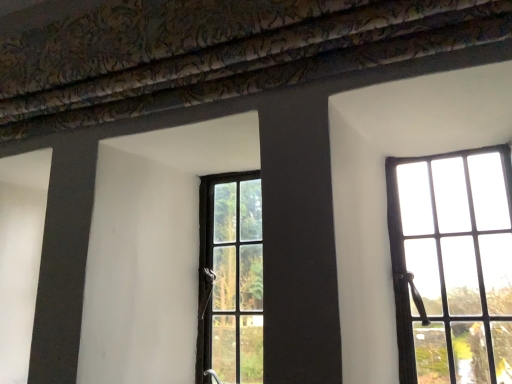
Question: Which direction should I rotate to face matte black window at center, the first window positioned from the left, — up or down?

Choices:
 (A) down
 (B) up

Answer: (A)

Question: Is matte black window at right, positioned as the second window in left-to-right order, shorter than matte black window at center, the first window positioned from the left?

Choices:
 (A) no
 (B) yes

Answer: (B)

Question: From the image's perspective, would you say matte black window at right, placed as the first window when sorted from right to left, is positioned over matte black window at center, the first window positioned from the left?

Choices:
 (A) yes
 (B) no

Answer: (A)

Question: Does matte black window at right, placed as the first window when sorted from right to left, appear on the right side of matte black window at center, the 2th window in the right-to-left sequence?

Choices:
 (A) no
 (B) yes

Answer: (B)

Question: Is matte black window at right, positioned as the second window in left-to-right order, at the left side of matte black window at center, the first window positioned from the left?

Choices:
 (A) no
 (B) yes

Answer: (A)

Question: Is matte black window at center, the 2th window in the right-to-left sequence, inside matte black window at right, positioned as the second window in left-to-right order?

Choices:
 (A) no
 (B) yes

Answer: (A)

Question: From a real-world perspective, is matte black window at right, positioned as the second window in left-to-right order, on top of matte black window at center, the first window positioned from the left?

Choices:
 (A) no
 (B) yes

Answer: (B)

Question: Is matte black window at center, the first window positioned from the left, at the right side of matte black window at right, placed as the first window when sorted from right to left?

Choices:
 (A) no
 (B) yes

Answer: (A)

Question: Considering the relative sizes of matte black window at center, the first window positioned from the left, and matte black window at right, placed as the first window when sorted from right to left, in the image provided, is matte black window at center, the first window positioned from the left, bigger than matte black window at right, placed as the first window when sorted from right to left,?

Choices:
 (A) yes
 (B) no

Answer: (B)

Question: Are matte black window at center, the first window positioned from the left, and matte black window at right, placed as the first window when sorted from right to left, located far from each other?

Choices:
 (A) no
 (B) yes

Answer: (A)

Question: Is matte black window at center, the first window positioned from the left, smaller than matte black window at right, placed as the first window when sorted from right to left?

Choices:
 (A) no
 (B) yes

Answer: (B)

Question: Is matte black window at center, the first window positioned from the left, positioned with its back to matte black window at right, placed as the first window when sorted from right to left?

Choices:
 (A) yes
 (B) no

Answer: (B)

Question: Can you confirm if matte black window at center, the 2th window in the right-to-left sequence, is shorter than matte black window at right, placed as the first window when sorted from right to left?

Choices:
 (A) no
 (B) yes

Answer: (A)

Question: Based on their sizes in the image, would you say matte black window at right, placed as the first window when sorted from right to left, is bigger or smaller than matte black window at center, the 2th window in the right-to-left sequence?

Choices:
 (A) small
 (B) big

Answer: (B)